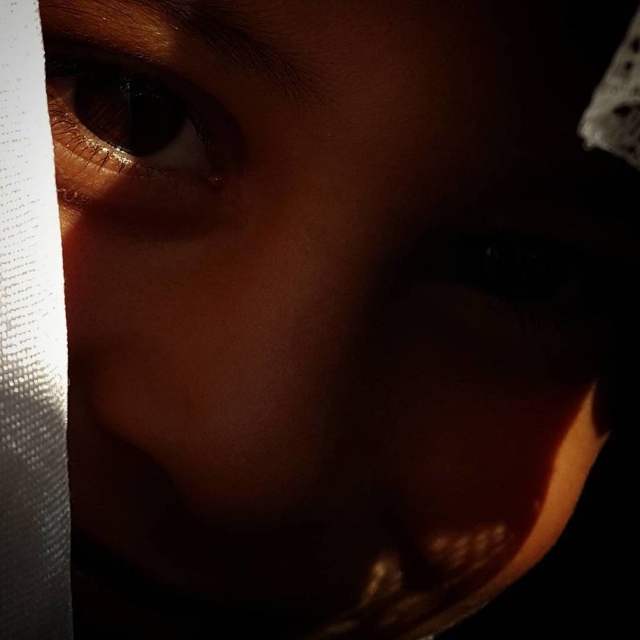
Question: Where is brown matte eye at upper left located in relation to black matte eye at center in the image?

Choices:
 (A) right
 (B) left

Answer: (B)

Question: Can you confirm if brown matte eye at upper left is positioned above black matte eye at center?

Choices:
 (A) no
 (B) yes

Answer: (B)

Question: Is brown matte eye at upper left above black matte eye at center?

Choices:
 (A) no
 (B) yes

Answer: (B)

Question: Which of the following is the farthest from the observer?

Choices:
 (A) click(x=154, y=211)
 (B) click(x=579, y=282)

Answer: (B)